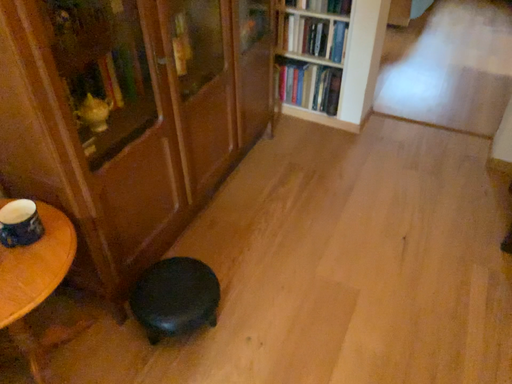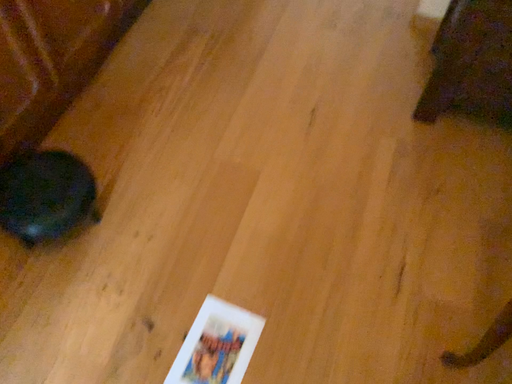
Question: How did the camera likely rotate when shooting the video?

Choices:
 (A) rotated downward
 (B) rotated upward

Answer: (A)